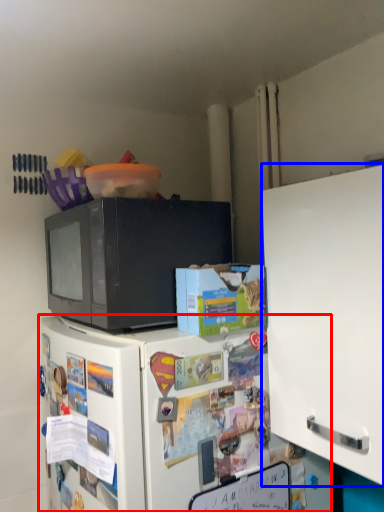
Question: Which object appears farthest to the camera in this image, refrigerator (highlighted by a red box) or cabinetry (highlighted by a blue box)?

Choices:
 (A) refrigerator
 (B) cabinetry

Answer: (A)